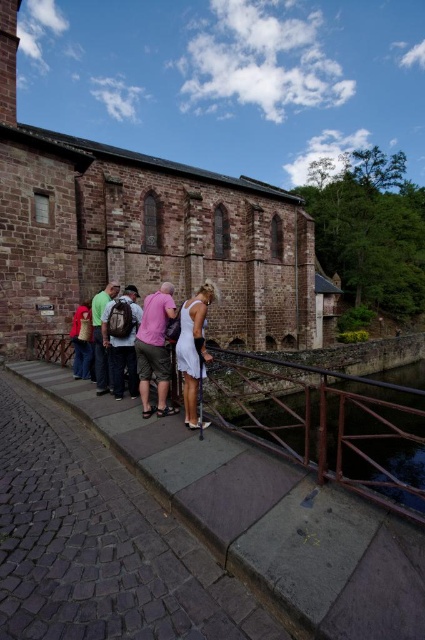
Question: Is white satin dress at center bigger than green fabric shirt at center?

Choices:
 (A) no
 (B) yes

Answer: (B)

Question: Is pink cotton shirt at center above green fabric shirt at center?

Choices:
 (A) no
 (B) yes

Answer: (B)

Question: Which of these objects is positioned closest to the brown stone church at center?

Choices:
 (A) red cotton shirt at lower left
 (B) dark gray backpack at center

Answer: (A)

Question: Which is farther from the pink cotton shirt at center?

Choices:
 (A) red cotton shirt at lower left
 (B) white satin dress at center
 (C) brown stone church at center
 (D) green fabric shirt at center

Answer: (C)

Question: Which object is the farthest from the white satin dress at center?

Choices:
 (A) green fabric shirt at center
 (B) rusty metal railing at center
 (C) red cotton shirt at lower left

Answer: (B)

Question: Does dark gray backpack at center come behind green fabric shirt at center?

Choices:
 (A) no
 (B) yes

Answer: (A)